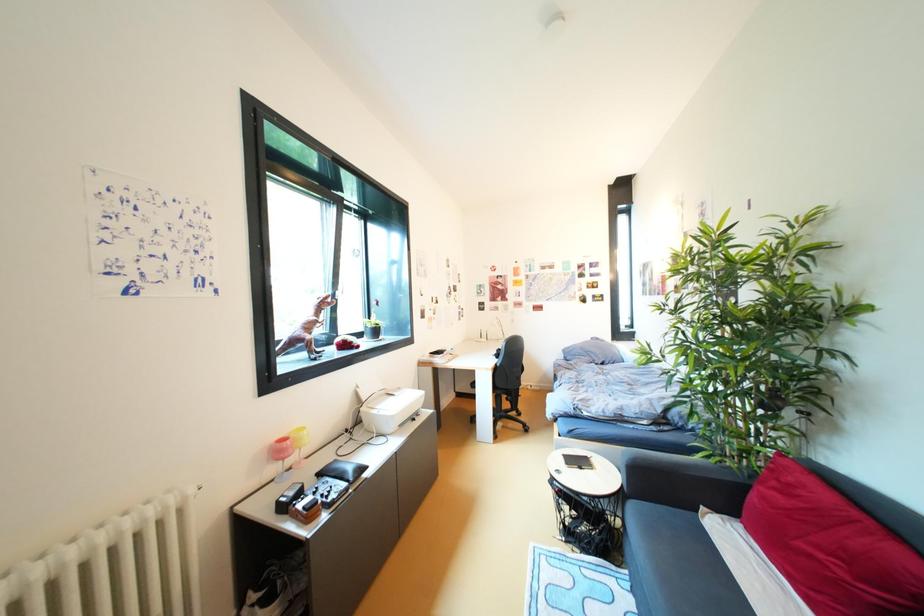
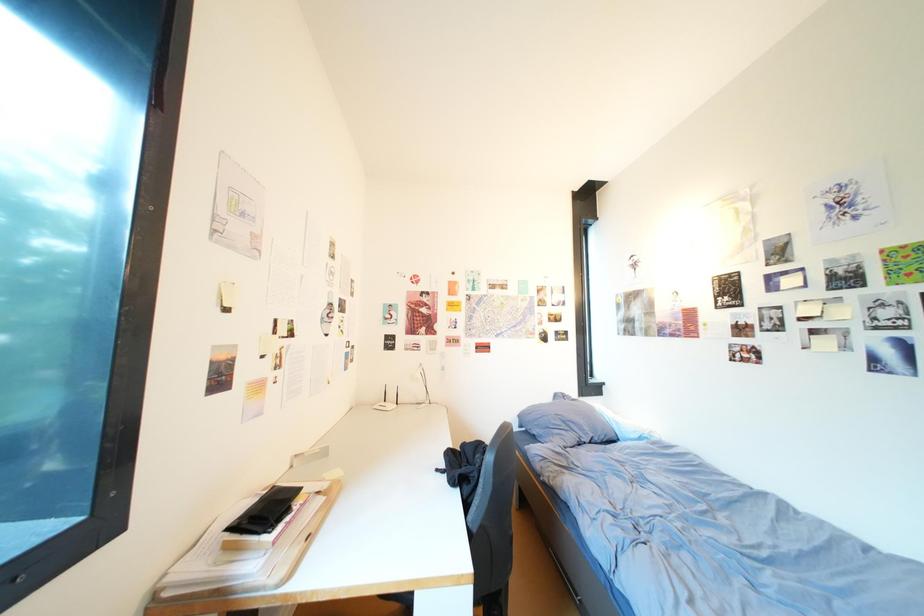
Question: Which direction would the cameraman need to move to produce the second image? Reply with the corresponding letter.

Choices:
 (A) Left
 (B) Right
 (C) Forward
 (D) Backward

Answer: (C)